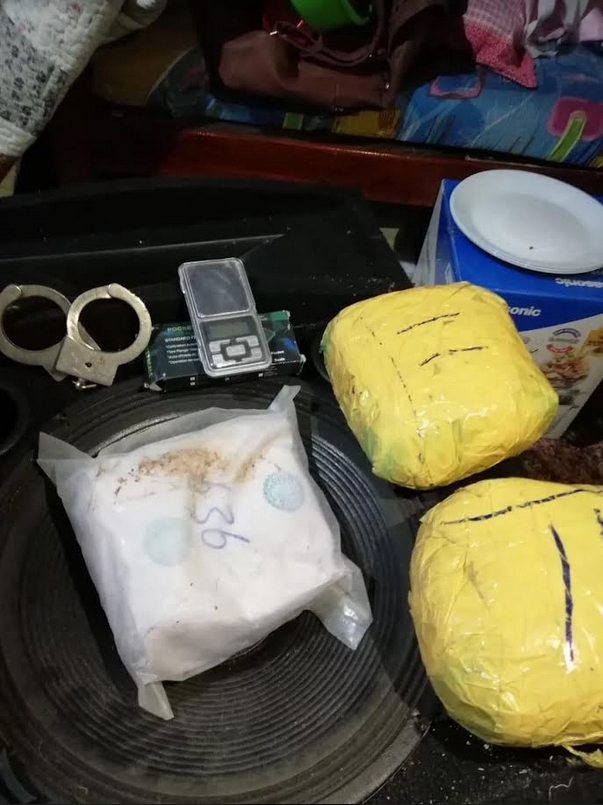
I want to click on reddish brown bed frame, so click(x=379, y=167).